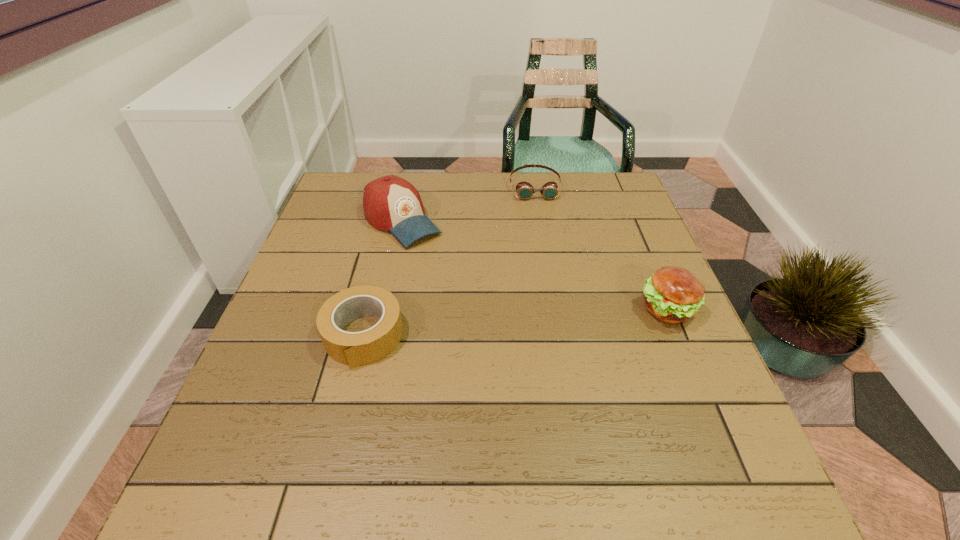
Locate an element on the screen. The image size is (960, 540). free space on the desktop that is between the second shortest object and the rightmost object and is positioned on the front-facing side of the baseball cap is located at coordinates (510, 323).

At what (x,y) coordinates should I click in order to perform the action: click on vacant space on the desktop that is between the duct tape and the rightmost object and is positioned through the lenses of the third object from left to right. Please return your answer as a coordinate pair (x, y). Looking at the image, I should click on click(x=558, y=320).